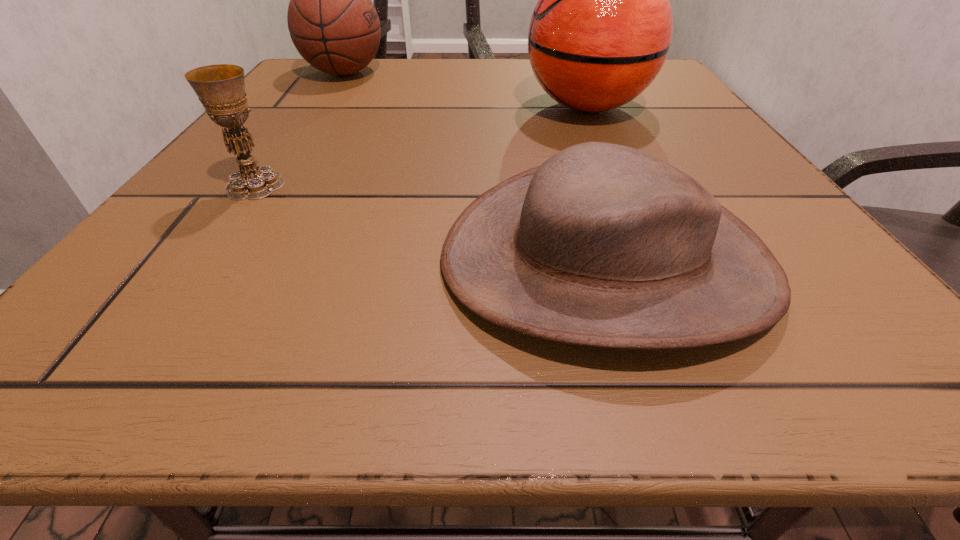
Identify the location of free space that is in between the chalice and the shortest object. (431, 222).

At what (x,y) coordinates should I click in order to perform the action: click on empty location between the chalice and the cowboy hat. Please return your answer as a coordinate pair (x, y). This screenshot has width=960, height=540. Looking at the image, I should click on (431, 222).

I want to click on unoccupied area between the taller basketball and the third tallest object, so click(x=421, y=146).

The height and width of the screenshot is (540, 960). What are the coordinates of `object that is the third nearest to the chalice` in the screenshot? It's located at (600, 33).

Identify the location of the third closest object to the shorter basketball. (603, 245).

You are a GUI agent. You are given a task and a screenshot of the screen. Output one action in this format:
    pyautogui.click(x=<x>, y=<y>)
    Task: Click on the vacant region that satisfies the following two spatial constraints: 1. on the side with brand label of the left basketball; 2. on the left side of the cowboy hat
    This screenshot has width=960, height=540.
    Given the screenshot: What is the action you would take?
    pyautogui.click(x=223, y=260)

Identify the location of vacant region that satisfies the following two spatial constraints: 1. on the front side of the third tallest object; 2. on the right side of the cowboy hat. This screenshot has height=540, width=960. (203, 260).

Where is `vacant region that satisfies the following two spatial constraints: 1. on the front side of the shortest object; 2. on the right side of the third tallest object`? This screenshot has height=540, width=960. vacant region that satisfies the following two spatial constraints: 1. on the front side of the shortest object; 2. on the right side of the third tallest object is located at coordinates (203, 260).

At what (x,y) coordinates should I click in order to perform the action: click on free space that satisfies the following two spatial constraints: 1. on the side with spill of the taller basketball; 2. on the front side of the chalice. Please return your answer as a coordinate pair (x, y). Image resolution: width=960 pixels, height=540 pixels. Looking at the image, I should click on (621, 185).